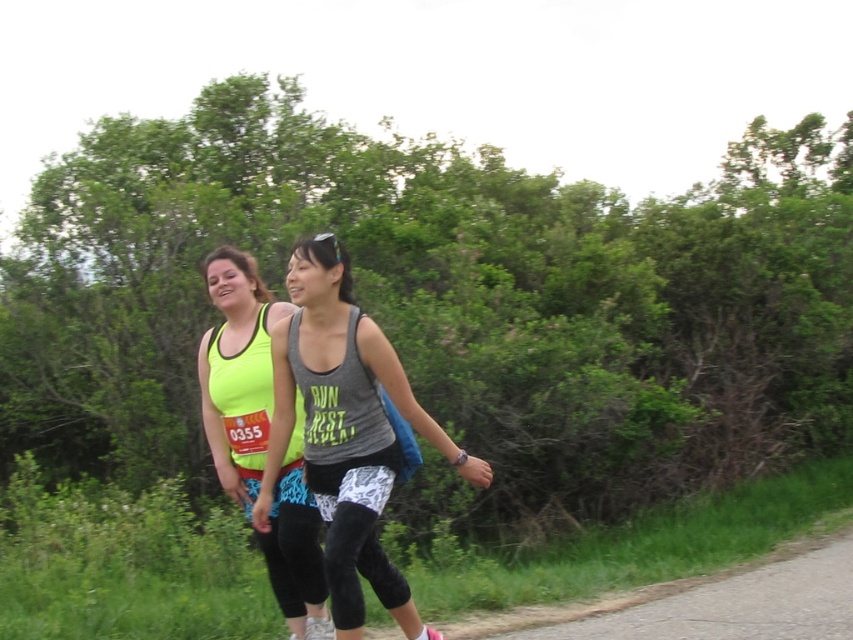
You are a photographer trying to capture a closeup of the runner with the race bib number 0355. You are positioned at point (305, 454). There is another point at (682, 589). Which point is closer to you?

The point at (305, 454) is closer to you than the point at (682, 589).

You are a photographer standing at the starting line of the race. You need to capture a photo that includes both the gray matte tank top at center and the gravel road at lower right. Based on their widths, which object should you adjust your camera angle to focus on first to ensure both fit in the frame?

The gray matte tank top at center is thinner than the gravel road at lower right. To ensure both fit in the frame, focus on the thinner gray matte tank top at center first and then adjust to include the wider gravel road at lower right.